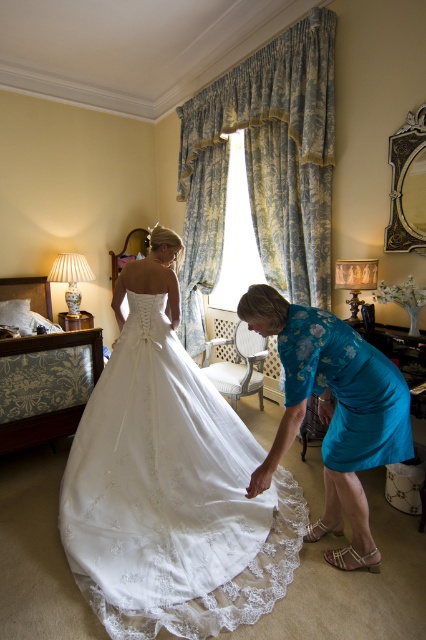
Based on the photo, you are a photographer in the bridal suite and need to position the white lace dress at center and the matte blue dress at lower right for a photo shoot. Which dress has a larger width when viewed from the front?

The white lace dress at center has a larger width than the matte blue dress at lower right according to the description.

You are a photographer positioned at the center of the room. You want to capture a photo of both the white lace dress at center and the matte blue dress at lower right in the same frame. Given the camera you have can only focus on objects within a 40 inch range, will both dresses be in focus?

The distance between the white lace dress at center and the matte blue dress at lower right is 32.79 inches, which is within the camera focus range of 40 inches. Therefore, both dresses will be in focus.